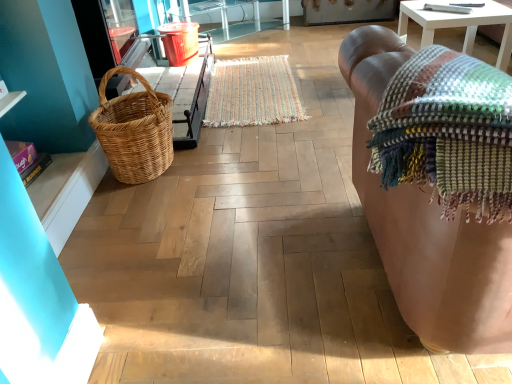
Question: Does multicolored woven mat at center come behind multicolored woven blanket at right?

Choices:
 (A) no
 (B) yes

Answer: (B)

Question: Is the depth of multicolored woven mat at center less than that of multicolored woven blanket at right?

Choices:
 (A) no
 (B) yes

Answer: (A)

Question: From a real-world perspective, is multicolored woven mat at center on multicolored woven blanket at right?

Choices:
 (A) yes
 (B) no

Answer: (B)

Question: Are multicolored woven mat at center and multicolored woven blanket at right beside each other?

Choices:
 (A) yes
 (B) no

Answer: (B)

Question: Is multicolored woven mat at center oriented towards multicolored woven blanket at right?

Choices:
 (A) no
 (B) yes

Answer: (A)

Question: Is point (490, 233) closer or farther from the camera than point (137, 135)?

Choices:
 (A) closer
 (B) farther

Answer: (A)

Question: Based on their positions, is leather couch at right located to the left or right of woven natural picnic basket at left?

Choices:
 (A) left
 (B) right

Answer: (B)

Question: Is leather couch at right situated inside woven natural picnic basket at left or outside?

Choices:
 (A) inside
 (B) outside

Answer: (B)

Question: Considering their positions, is leather couch at right located in front of or behind woven natural picnic basket at left?

Choices:
 (A) behind
 (B) front

Answer: (B)

Question: From the image's perspective, is multicolored woven mat at center positioned above or below leather couch at right?

Choices:
 (A) below
 (B) above

Answer: (B)

Question: Is multicolored woven mat at center inside the boundaries of leather couch at right, or outside?

Choices:
 (A) inside
 (B) outside

Answer: (B)

Question: From a real-world perspective, is multicolored woven mat at center above or below leather couch at right?

Choices:
 (A) above
 (B) below

Answer: (B)

Question: From their relative heights in the image, would you say multicolored woven mat at center is taller or shorter than leather couch at right?

Choices:
 (A) tall
 (B) short

Answer: (B)

Question: In terms of width, does multicolored woven blanket at right look wider or thinner when compared to leather couch at right?

Choices:
 (A) wide
 (B) thin

Answer: (B)

Question: Is multicolored woven blanket at right bigger or smaller than leather couch at right?

Choices:
 (A) big
 (B) small

Answer: (B)